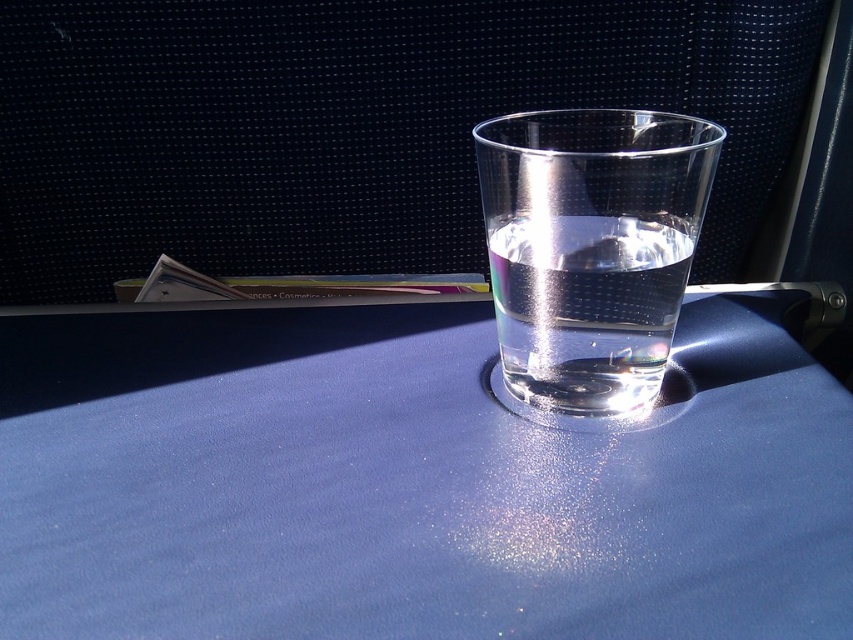
You are a flight attendant checking the in flight amenities. You see the blue matte table at center and the transparent glass at center. Which object is positioned lower in the image?

The blue matte table at center is positioned below the transparent glass at center, so it is lower in the image.

You are a flight attendant checking the tray tables. You have a small item that needs to be placed on the blue matte table at center without covering the transparent glass at center. Can you fit it there?

The blue matte table at center is larger in size than transparent glass at center, so there is enough space to place the small item on the blue matte table at center without covering the transparent glass at center.

You are sitting in an airplane seat and looking at the tray table in front of you. There are two points marked on the table surface. One is at point coordinates point (579, 454) and the other at point coordinates point (525, 195). Which point is closer to you, the passenger?

Point (525, 195) is closer to you because point (579, 454) is behind it.